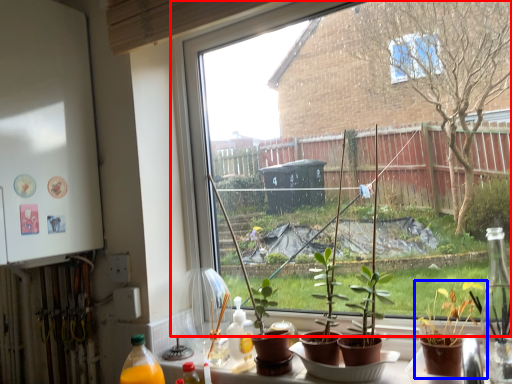
Question: Which of the following is the farthest to the observer, window (highlighted by a red box) or houseplant (highlighted by a blue box)?

Choices:
 (A) window
 (B) houseplant

Answer: (A)